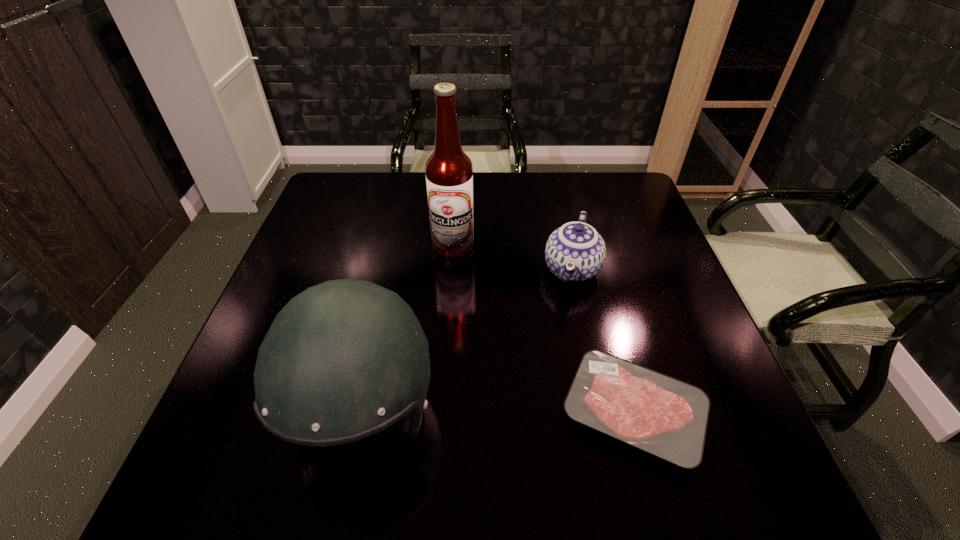
Find the location of a particular element. The image size is (960, 540). unoccupied position between the chinaware and the tallest object is located at coordinates (513, 258).

The image size is (960, 540). I want to click on unoccupied area between the football helmet and the shortest object, so click(498, 413).

Choose which object is the nearest neighbor to the third shortest object. Please provide its 2D coordinates. Your answer should be formatted as a tuple, i.e. [(x, y)], where the tuple contains the x and y coordinates of a point satisfying the conditions above.

[(666, 417)]

Locate an element on the screen. This screenshot has width=960, height=540. object that is the second nearest to the shortest object is located at coordinates (345, 359).

Locate an element on the screen. free space that satisfies the following two spatial constraints: 1. on the front side of the chinaware; 2. on the left side of the alcohol is located at coordinates (451, 270).